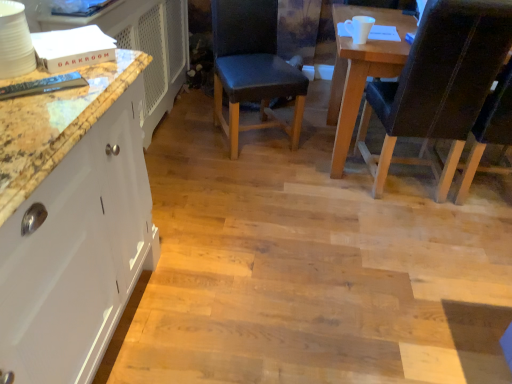
Question: From a real-world perspective, is leather-like black chair at right, positioned as the 1th chair in right-to-left order, physically located above or below dark blue leather chair at center, the second chair when ordered from right to left?

Choices:
 (A) below
 (B) above

Answer: (B)

Question: Is leather-like black chair at right, positioned as the 1th chair in right-to-left order, to the left or to the right of dark blue leather chair at center, acting as the first chair starting from the left, in the image?

Choices:
 (A) right
 (B) left

Answer: (A)

Question: Choose the correct answer: Is leather-like black chair at right, marked as the 2th chair in a left-to-right arrangement, inside dark blue leather chair at center, the second chair when ordered from right to left, or outside it?

Choices:
 (A) inside
 (B) outside

Answer: (B)

Question: Is dark blue leather chair at center, acting as the first chair starting from the left, in front of or behind leather-like black chair at right, positioned as the 1th chair in right-to-left order, in the image?

Choices:
 (A) front
 (B) behind

Answer: (B)

Question: Visually, is dark blue leather chair at center, the second chair when ordered from right to left, positioned to the left or to the right of leather-like black chair at right, marked as the 2th chair in a left-to-right arrangement?

Choices:
 (A) right
 (B) left

Answer: (B)

Question: From the image's perspective, is dark blue leather chair at center, the second chair when ordered from right to left, above or below leather-like black chair at right, positioned as the 1th chair in right-to-left order?

Choices:
 (A) below
 (B) above

Answer: (B)

Question: Is dark blue leather chair at center, the second chair when ordered from right to left, situated inside leather-like black chair at right, positioned as the 1th chair in right-to-left order, or outside?

Choices:
 (A) outside
 (B) inside

Answer: (A)